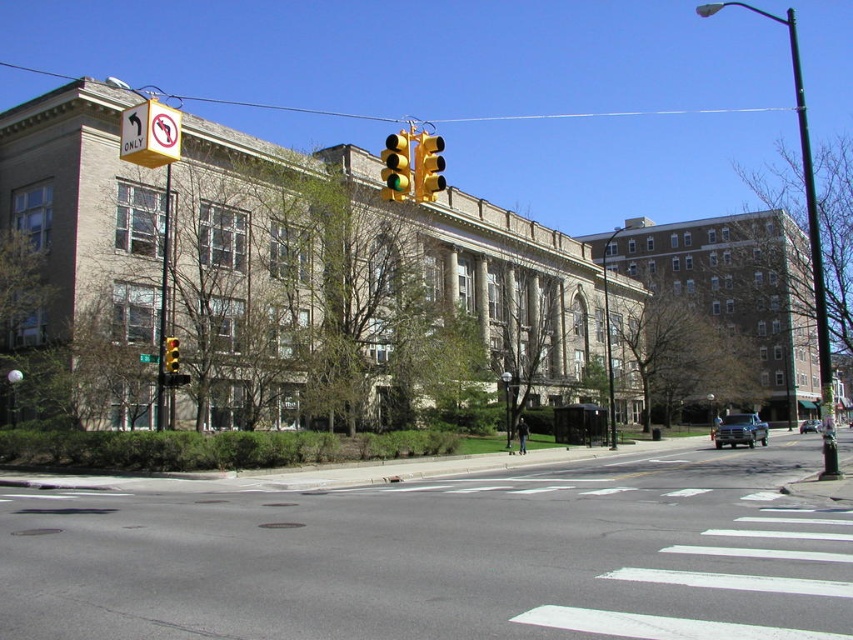
Question: Does metallic silver sedan at center have a greater width compared to green plastic street sign at upper center?

Choices:
 (A) yes
 (B) no

Answer: (A)

Question: Among these objects, which one is farthest from the camera?

Choices:
 (A) yellow metallic traffic light at center
 (B) yellow plastic traffic light at upper center
 (C) yellow glass traffic light at center
 (D) metallic silver sedan at center

Answer: (D)

Question: Which point is closer to the camera taking this photo?

Choices:
 (A) (138, 356)
 (B) (169, 208)
 (C) (165, 360)
 (D) (815, 316)

Answer: (C)

Question: Based on their relative distances, which object is nearer to the yellow metallic traffic light at center?

Choices:
 (A) yellow plastic sign at upper left
 (B) green metallic pole at right
 (C) metallic silver truck at right
 (D) yellow plastic traffic light at center

Answer: (A)

Question: Can you confirm if yellow glass traffic light at center is positioned to the left of metallic silver sedan at center?

Choices:
 (A) yes
 (B) no

Answer: (A)

Question: Does yellow glass traffic light at center appear on the left side of metallic silver truck at right?

Choices:
 (A) no
 (B) yes

Answer: (B)